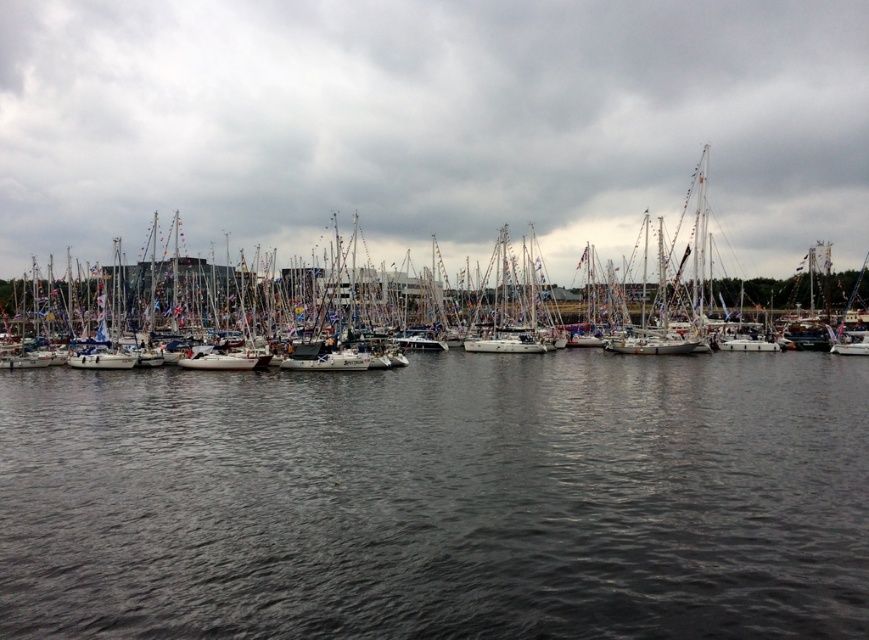
Question: Which point is closer to the camera?

Choices:
 (A) (483, 284)
 (B) (830, 477)

Answer: (B)

Question: Considering the real-world distances, which object is farthest from the dark gray water at center?

Choices:
 (A) white matte sailboat at center
 (B) white matte boats at center

Answer: (B)

Question: Does dark gray water at center come behind white matte sailboat at center?

Choices:
 (A) yes
 (B) no

Answer: (B)

Question: Among these points, which one is farthest from the camera?

Choices:
 (A) (41, 605)
 (B) (542, 304)
 (C) (750, 100)

Answer: (C)

Question: Can you confirm if dark gray water at center is bigger than white matte sailboat at center?

Choices:
 (A) no
 (B) yes

Answer: (A)

Question: Can you confirm if white matte boats at center is positioned to the right of white matte sailboat at center?

Choices:
 (A) no
 (B) yes

Answer: (A)